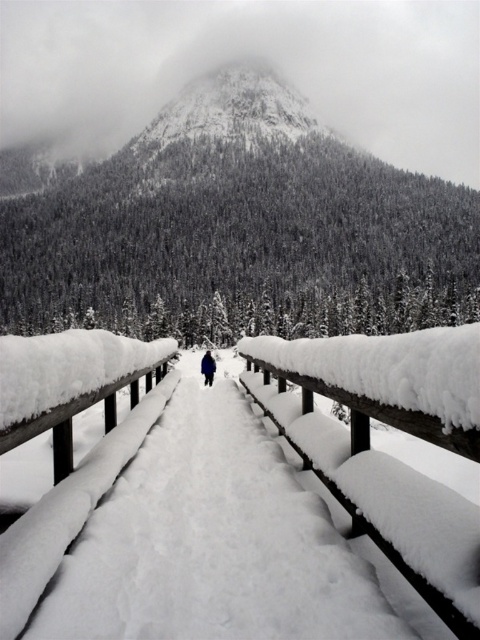
Question: Based on their relative distances, which object is farther from the wooden rail at center?

Choices:
 (A) snowy textured mountain at upper center
 (B) dark blue fabric skier at center

Answer: (A)

Question: In this image, where is snowy textured mountain at upper center located relative to wooden rail at center?

Choices:
 (A) left
 (B) right

Answer: (A)

Question: Which object is farther from the camera taking this photo?

Choices:
 (A) snowy textured mountain at upper center
 (B) dark blue fabric skier at center

Answer: (A)

Question: Is wooden rail at center above dark blue fabric skier at center?

Choices:
 (A) no
 (B) yes

Answer: (B)

Question: Which point is farther from the camera taking this photo?

Choices:
 (A) (327, 435)
 (B) (396, 312)

Answer: (B)

Question: Can you confirm if snowy textured mountain at upper center is smaller than wooden rail at center?

Choices:
 (A) no
 (B) yes

Answer: (A)